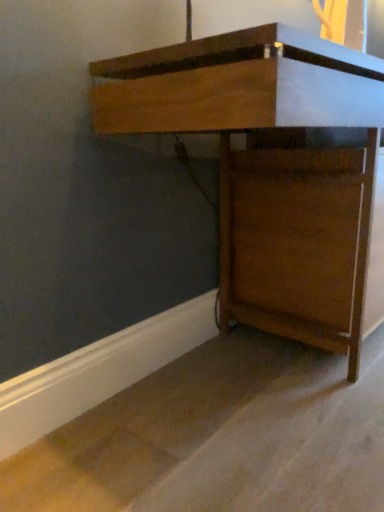
Question: In terms of size, does brown wood cabinet at lower right appear bigger or smaller than wooden desk at center?

Choices:
 (A) big
 (B) small

Answer: (B)

Question: From a real-world perspective, is brown wood cabinet at lower right physically located above or below wooden desk at center?

Choices:
 (A) above
 (B) below

Answer: (B)

Question: Is brown wood cabinet at lower right inside the boundaries of wooden desk at center, or outside?

Choices:
 (A) inside
 (B) outside

Answer: (B)

Question: Is wooden desk at center wider or thinner than brown wood cabinet at lower right?

Choices:
 (A) wide
 (B) thin

Answer: (B)

Question: From a real-world perspective, is wooden desk at center physically located above or below brown wood cabinet at lower right?

Choices:
 (A) above
 (B) below

Answer: (A)

Question: Is wooden desk at center bigger or smaller than brown wood cabinet at lower right?

Choices:
 (A) small
 (B) big

Answer: (B)

Question: From the image's perspective, relative to brown wood cabinet at lower right, is wooden desk at center above or below?

Choices:
 (A) below
 (B) above

Answer: (B)